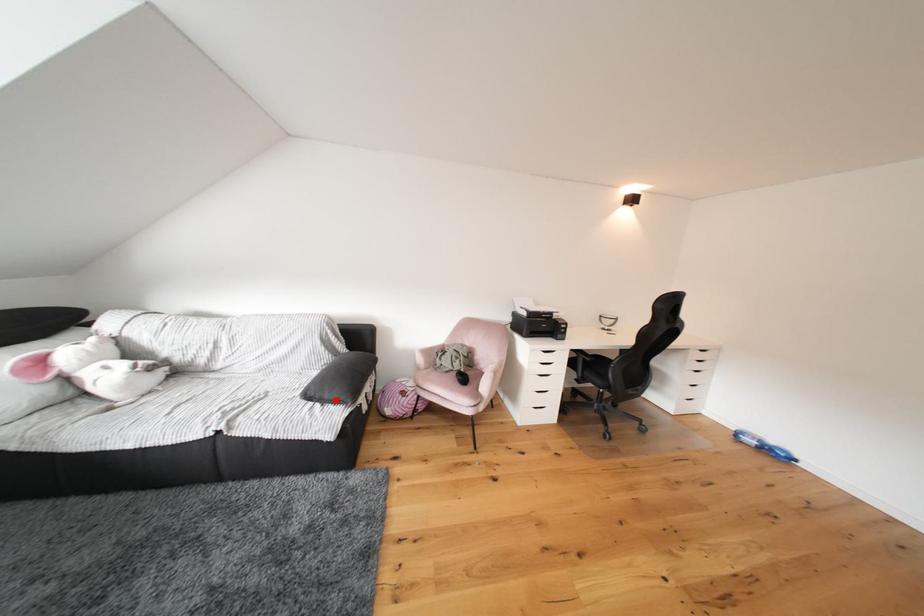
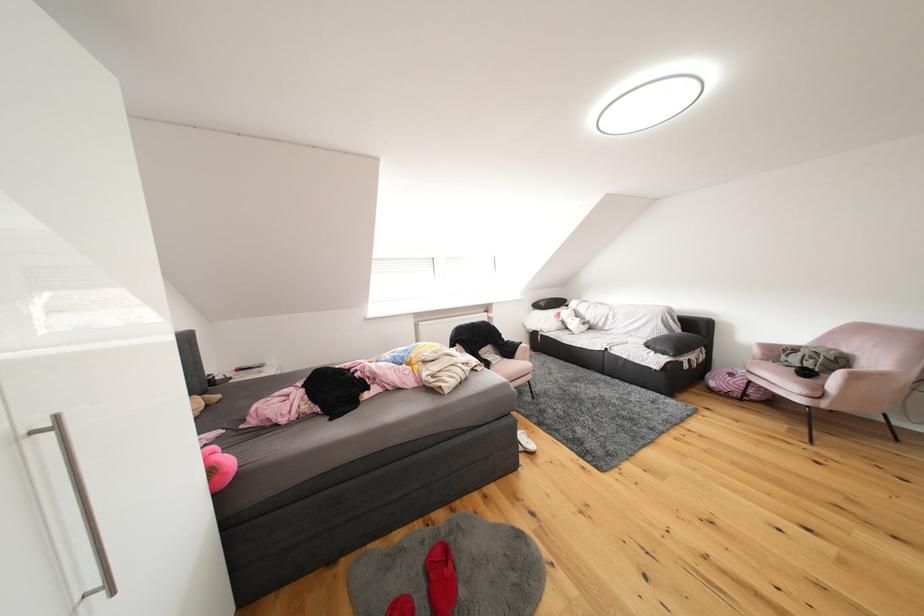
The point at the highlighted location is marked in the first image. Where is the corresponding point in the second image?

(667, 351)